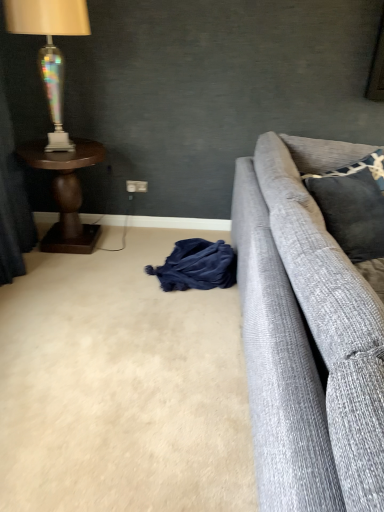
Question: Considering the relative positions of velvet dark blue curtain at left and beige carpet at lower left in the image provided, is velvet dark blue curtain at left behind beige carpet at lower left?

Choices:
 (A) yes
 (B) no

Answer: (B)

Question: Can you confirm if velvet dark blue curtain at left is bigger than beige carpet at lower left?

Choices:
 (A) yes
 (B) no

Answer: (A)

Question: From a real-world perspective, does velvet dark blue curtain at left sit lower than beige carpet at lower left?

Choices:
 (A) yes
 (B) no

Answer: (B)

Question: Is beige carpet at lower left at the back of velvet dark blue curtain at left?

Choices:
 (A) no
 (B) yes

Answer: (A)

Question: Can you confirm if velvet dark blue curtain at left is positioned to the right of beige carpet at lower left?

Choices:
 (A) yes
 (B) no

Answer: (B)

Question: Does velvet dark blue curtain at left have a smaller size compared to beige carpet at lower left?

Choices:
 (A) no
 (B) yes

Answer: (A)

Question: Is velvet dark blue curtain at left far away from dark gray textured pillow at right, marked as the 2th pillow in a top-to-bottom arrangement?

Choices:
 (A) no
 (B) yes

Answer: (B)

Question: From the image's perspective, is velvet dark blue curtain at left located above dark gray textured pillow at right, acting as the 1th pillow starting from the bottom?

Choices:
 (A) yes
 (B) no

Answer: (A)

Question: Can you confirm if velvet dark blue curtain at left is wider than dark gray textured pillow at right, acting as the 1th pillow starting from the bottom?

Choices:
 (A) yes
 (B) no

Answer: (B)

Question: Is velvet dark blue curtain at left looking in the opposite direction of dark gray textured pillow at right, acting as the 1th pillow starting from the bottom?

Choices:
 (A) no
 (B) yes

Answer: (A)

Question: Is the position of velvet dark blue curtain at left more distant than that of dark gray textured pillow at right, acting as the 1th pillow starting from the bottom?

Choices:
 (A) yes
 (B) no

Answer: (B)

Question: Is velvet dark blue curtain at left at the left side of dark gray textured pillow at right, acting as the 1th pillow starting from the bottom?

Choices:
 (A) no
 (B) yes

Answer: (B)

Question: Is iridescent glass lamp at left facing away from dark gray textured pillow at right, acting as the 1th pillow starting from the bottom?

Choices:
 (A) yes
 (B) no

Answer: (B)